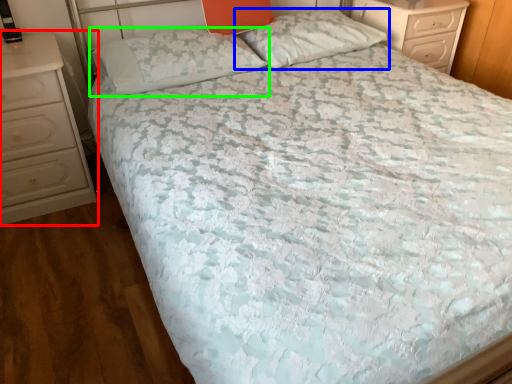
Question: Which is nearer to the chest of drawers (highlighted by a red box)? pillow (highlighted by a blue box) or pillow (highlighted by a green box).

Choices:
 (A) pillow
 (B) pillow

Answer: (B)